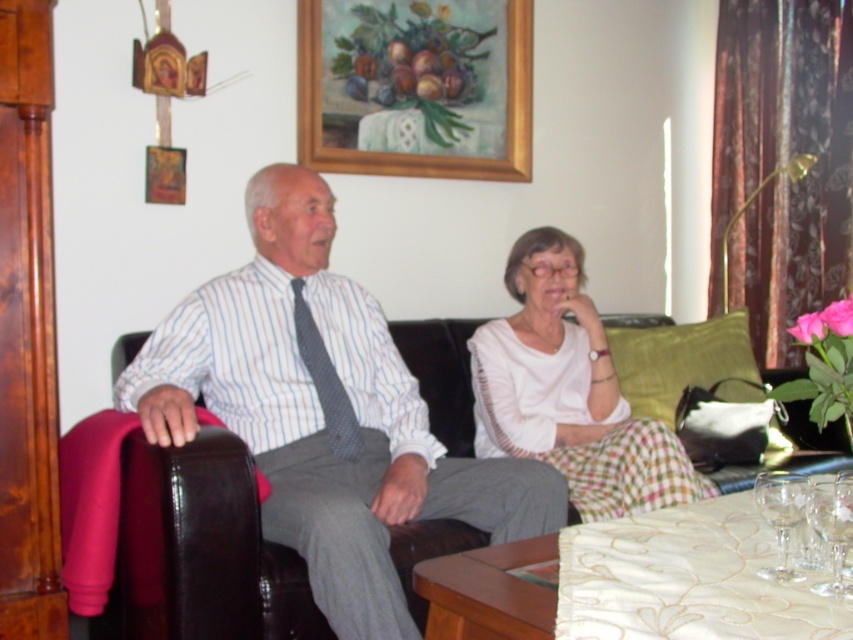
Looking at this image, you are a guest at a dinner party and need to place your napkin on the table. The table has the transparent glass wine glass at lower right and the white cotton blouse at center. Which item should you avoid placing the napkin near to prevent it from getting wet?

You should avoid placing the napkin near the transparent glass wine glass at lower right because it is smaller and more likely to have liquid spill over onto nearby items, whereas the white cotton blouse at center is larger and less likely to cause such an issue.

You are a guest in this living room and want to place a small book on the table between the white cotton blouse at center and the transparent glass wine glass at lower right. Which object should you use as a reference to ensure the book is placed closer to the wider object?

The white cotton blouse at center is wider than the transparent glass wine glass at lower right. Place the book closer to the white cotton blouse at center.

You are a delivery robot that needs to place a small package between the striped cotton shirt at center and the transparent glass wine glass at lower right. The package is 40 centimeters long. Can you fit it between them?

The distance between the striped cotton shirt at center and the transparent glass wine glass at lower right is 85.32 centimeters. Since the package is 40 centimeters long, it can easily fit between them as there is enough space.